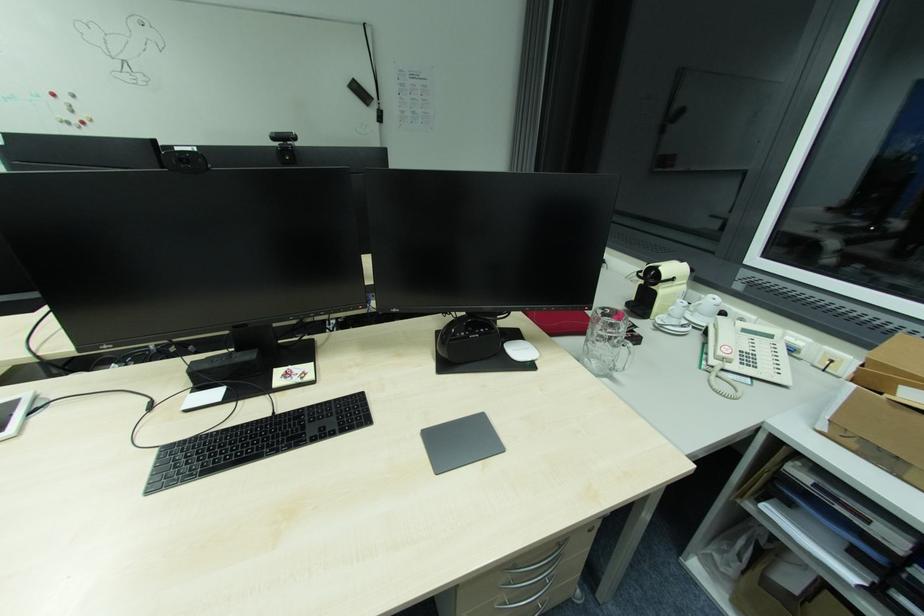
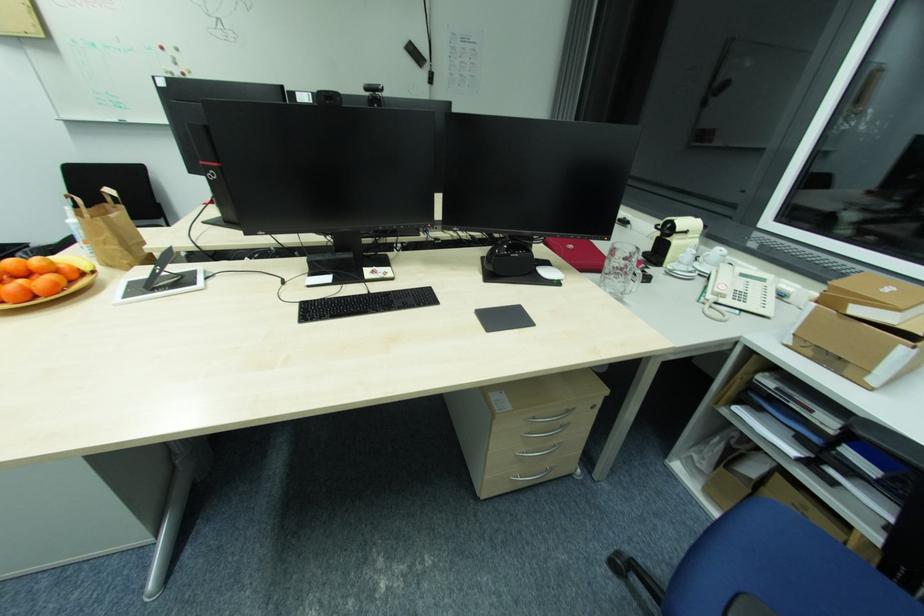
Question: In a continuous first-person perspective shot, in which direction is the camera moving?

Choices:
 (A) Left
 (B) Right
 (C) Forward
 (D) Backward

Answer: (D)